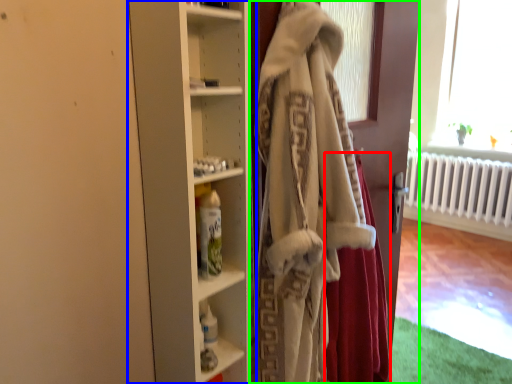
Question: Estimate the real-world distances between objects in this image. Which object is farther from shawl (highlighted by a red box), cupboard (highlighted by a blue box) or door (highlighted by a green box)?

Choices:
 (A) cupboard
 (B) door

Answer: (A)